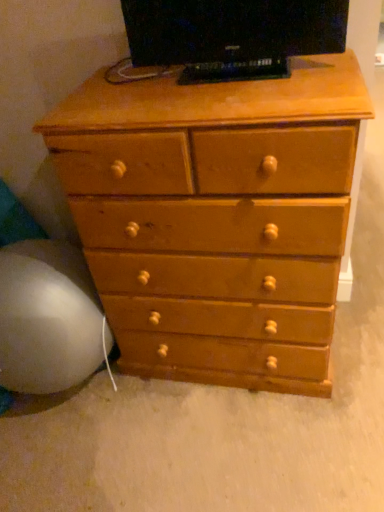
Question: Is matte black tv at upper center inside the boundaries of light brown wood chest of drawers at center, or outside?

Choices:
 (A) inside
 (B) outside

Answer: (B)

Question: In the image, is matte black tv at upper center positioned in front of or behind light brown wood chest of drawers at center?

Choices:
 (A) behind
 (B) front

Answer: (A)

Question: Which object is positioned closest to the white fabric bean bag at lower left?

Choices:
 (A) light brown wood chest of drawers at center
 (B) matte black tv at upper center

Answer: (A)

Question: Which is farther from the light brown wood chest of drawers at center?

Choices:
 (A) white fabric bean bag at lower left
 (B) matte black tv at upper center

Answer: (A)